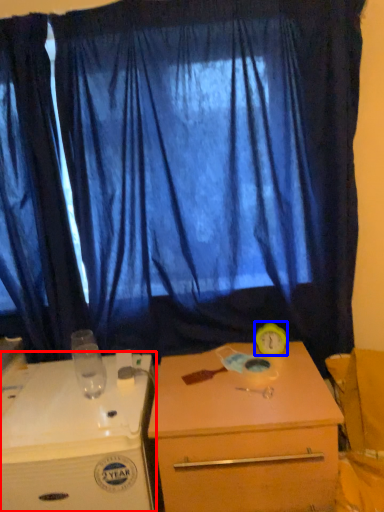
Question: Which of the following is the farthest to the observer, desk (highlighted by a red box) or alarm clock (highlighted by a blue box)?

Choices:
 (A) desk
 (B) alarm clock

Answer: (B)